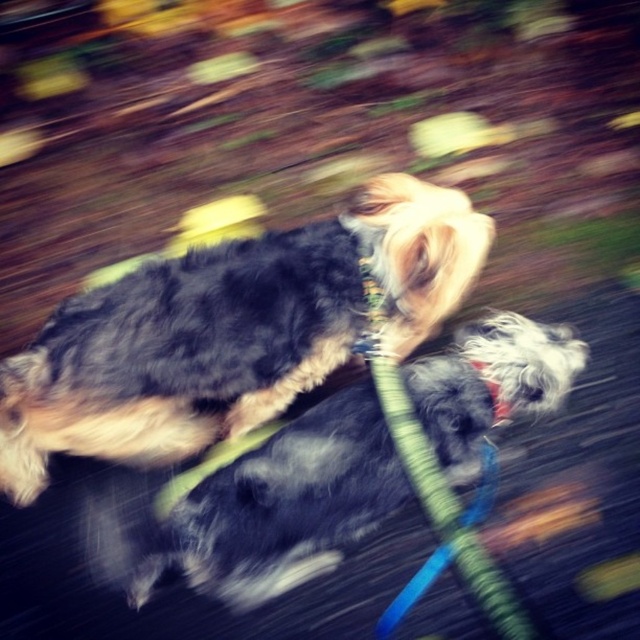
Question: Which of the following is the farthest from the observer?

Choices:
 (A) (496, 388)
 (B) (481, 445)
 (C) (468, 468)

Answer: (C)

Question: Where is green fabric leash at center located in relation to green fabric neckband at center in the image?

Choices:
 (A) below
 (B) above

Answer: (A)

Question: Observing the image, what is the correct spatial positioning of fluffy gray dog at center in reference to green fabric neckband at center?

Choices:
 (A) left
 (B) right

Answer: (A)

Question: Which object is closer to the camera taking this photo?

Choices:
 (A) fluffy black dog at center
 (B) green fabric neckband at center
 (C) green fabric leash at center
 (D) fluffy gray dog at center

Answer: (C)

Question: Which point is closer to the camera?

Choices:
 (A) green fabric neckband at center
 (B) fluffy gray dog at center
 (C) green fabric leash at center
 (D) fluffy black dog at center

Answer: (C)

Question: Is fluffy gray dog at center smaller than green fabric neckband at center?

Choices:
 (A) no
 (B) yes

Answer: (A)